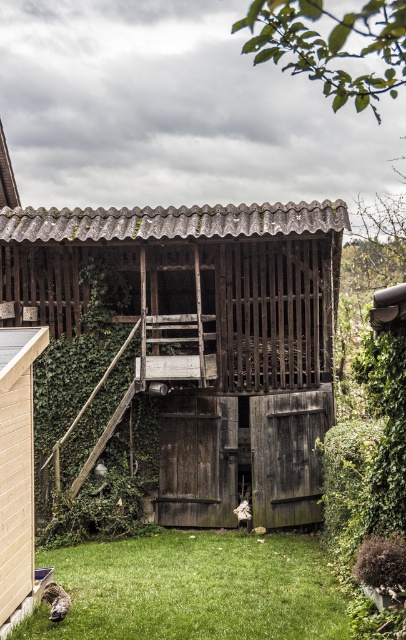
You are planning to store your gardening tools and need to choose between the weathered wood hut at center and the beige wood shed at lower left. Which one has more space inside?

The weathered wood hut at center is bigger than the beige wood shed at lower left, so it has more space inside.

You are standing in the backyard of the rustic wooden structure. You see a point marked at coordinates (194, 588). What is located at that point?

The point at coordinates (194, 588) corresponds to green grass at lower left.